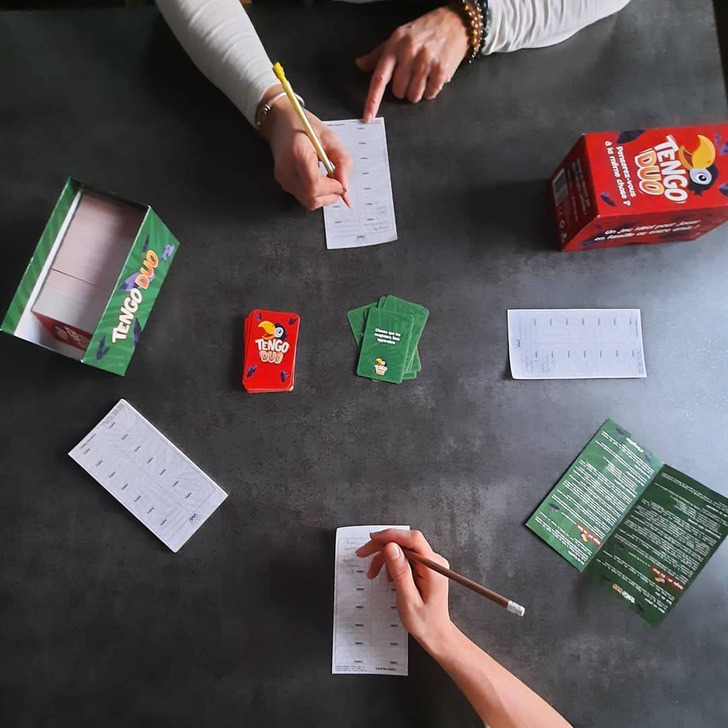
In order to click on black table in this screenshot , I will do `click(217, 622)`, `click(149, 130)`, `click(458, 178)`.